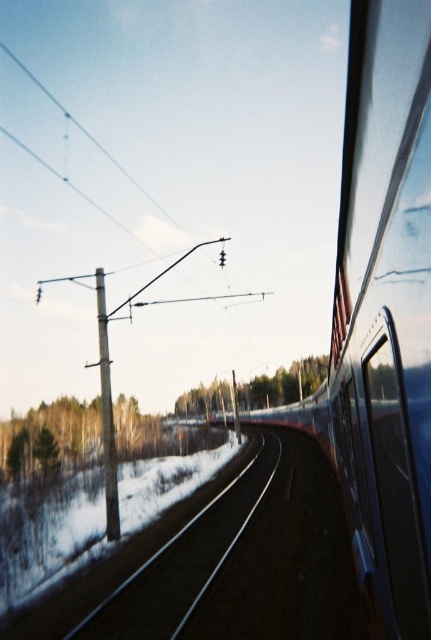
Is point (56, 467) positioned in front of point (102, 420)?

Yes, point (56, 467) is in front of point (102, 420).

Is the position of green matte tree at lower left less distant than that of wooden pole at left?

No, green matte tree at lower left is further to the viewer.

Between point (33, 422) and point (103, 387), which one is positioned behind?

The point (33, 422) is more distant.

This screenshot has width=431, height=640. In order to click on green matte tree at lower left in this screenshot , I will do `click(52, 438)`.

Is green matte tree at center positioned in front of wooden pole at left?

No, green matte tree at center is further to the viewer.

Does green matte tree at center lie behind wooden pole at left?

Yes, green matte tree at center is further from the viewer.

Is point (287, 394) positioned before point (112, 529)?

That is False.

Identify the location of green matte tree at center. (284, 384).

Is point (124, 444) farther from viewer compared to point (284, 400)?

No, it is in front of (284, 400).

I want to click on green matte tree at lower left, so click(x=52, y=438).